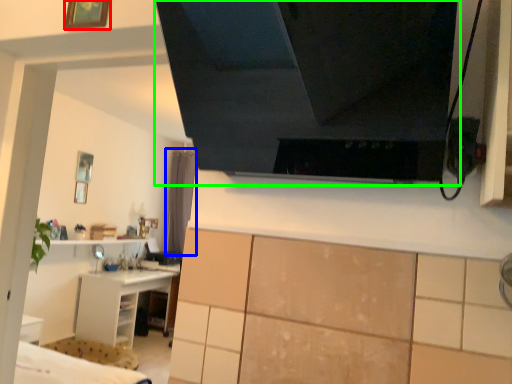
Question: Which is nearer to the picture frame (highlighted by a red box)? curtain (highlighted by a blue box) or exhaust hood (highlighted by a green box).

Choices:
 (A) curtain
 (B) exhaust hood

Answer: (B)